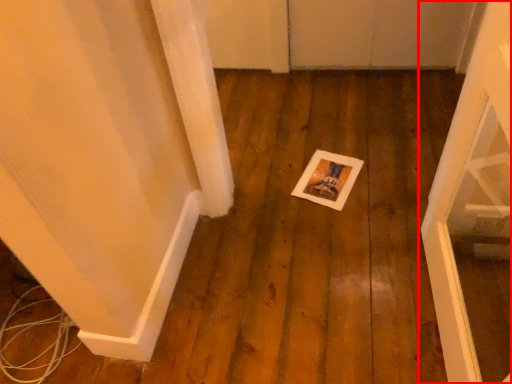
Question: From the image, what is the correct spatial relationship of door (annotated by the red box) in relation to postcard?

Choices:
 (A) right
 (B) left

Answer: (A)